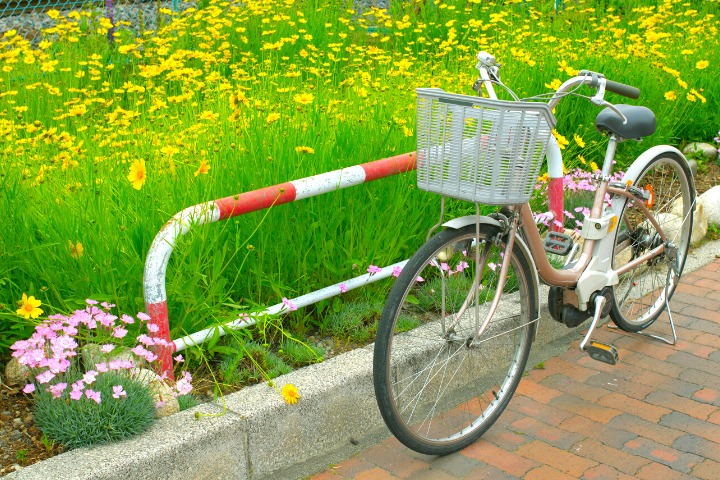
You are a GUI agent. You are given a task and a screenshot of the screen. Output one action in this format:
    pyautogui.click(x=<x>, y=<y>)
    Task: Click on the basket
    Image resolution: width=720 pixels, height=480 pixels.
    Given the screenshot: What is the action you would take?
    pyautogui.click(x=484, y=171)